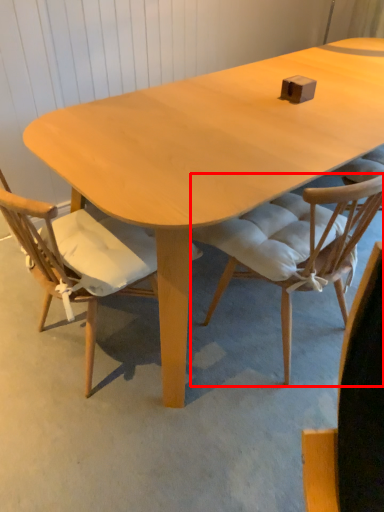
Question: From the image's perspective, what is the correct spatial positioning of chair (annotated by the red box) in reference to chair?

Choices:
 (A) above
 (B) below

Answer: (A)